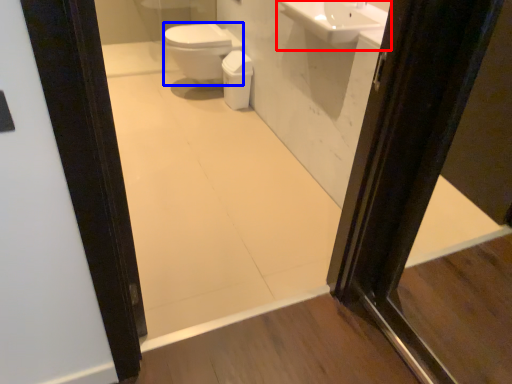
Question: Which of the following is the closest to the observer, sink (highlighted by a red box) or bidet (highlighted by a blue box)?

Choices:
 (A) sink
 (B) bidet

Answer: (A)